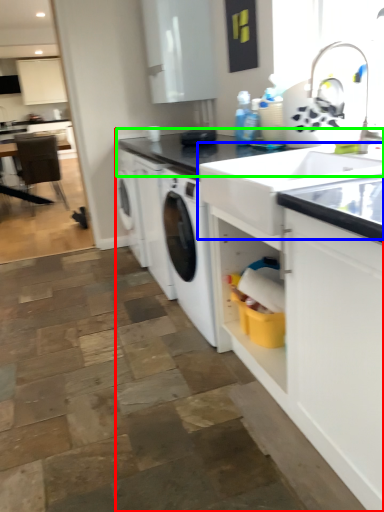
Question: Which is farther away from countertop (highlighted by a red box)? sink (highlighted by a blue box) or countertop (highlighted by a green box)?

Choices:
 (A) sink
 (B) countertop

Answer: (B)